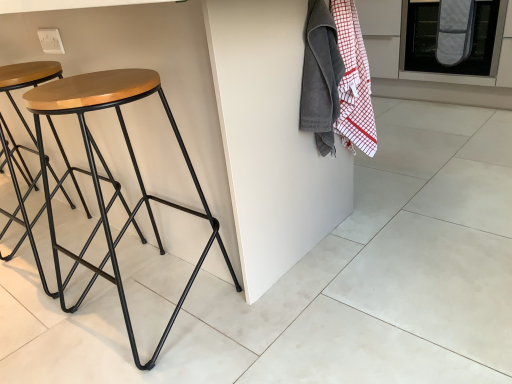
At what (x,y) coordinates should I click in order to perform the action: click on blank space situated above woodenmaterial/texturestool at left (from a real-world perspective). Please return your answer as a coordinate pair (x, y). This screenshot has height=384, width=512. Looking at the image, I should click on (91, 86).